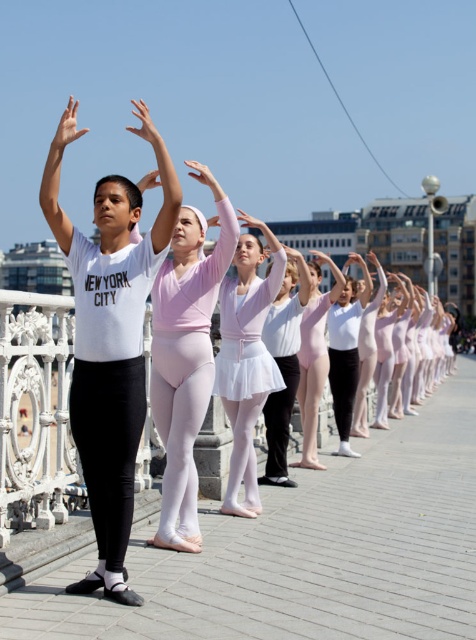
Question: Does matte white ballet skirt at center appear under white satin ballet skirt at center?

Choices:
 (A) no
 (B) yes

Answer: (A)

Question: From the image, what is the correct spatial relationship of white matte t-shirt at center in relation to pink satin leotard at center?

Choices:
 (A) above
 (B) below

Answer: (A)

Question: Among these points, which one is nearest to the camera?

Choices:
 (A) (51, 220)
 (B) (85, 435)
 (C) (158, 321)
 (D) (247, 353)

Answer: (B)

Question: Which point is farther to the camera?

Choices:
 (A) pink satin arm at center
 (B) matte white arm at upper center

Answer: (A)

Question: Among these points, which one is nearest to the camera?

Choices:
 (A) (112, 410)
 (B) (267, 342)
 (C) (122, 524)
 (D) (231, 369)

Answer: (C)

Question: Is white matte t-shirt at center smaller than matte white ballet skirt at center?

Choices:
 (A) no
 (B) yes

Answer: (A)